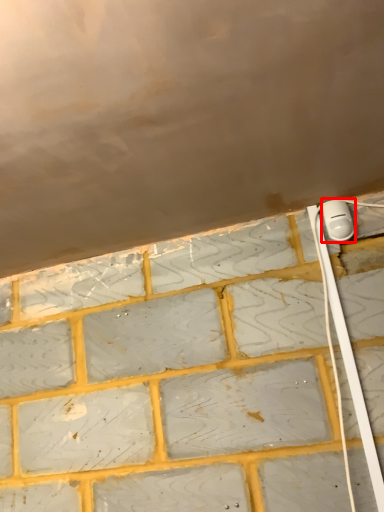
Question: From the image's perspective, where is power plugs and sockets (annotated by the red box) located in relation to cable in the image?

Choices:
 (A) above
 (B) below

Answer: (A)